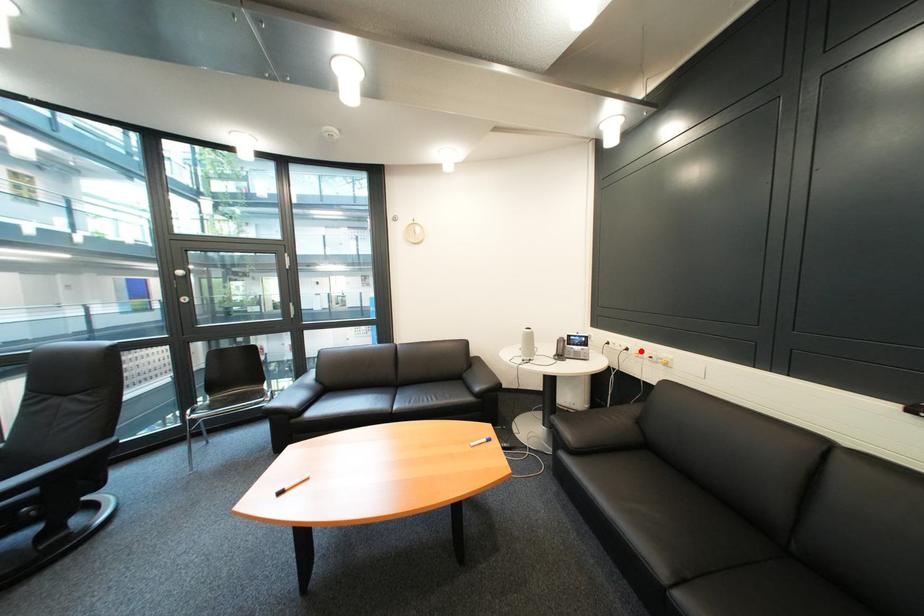
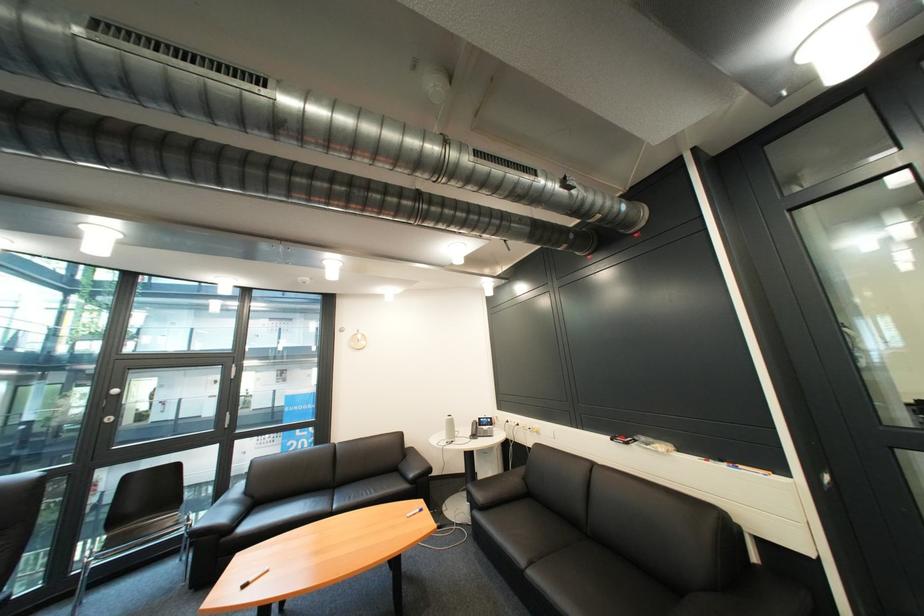
Question: A red point is marked in image1. In image2, is the corresponding 3D point closer to the camera or farther? Reply with the corresponding letter.

Choices:
 (A) The corresponding 3D point is closer.
 (B) The corresponding 3D point is farther.

Answer: (B)